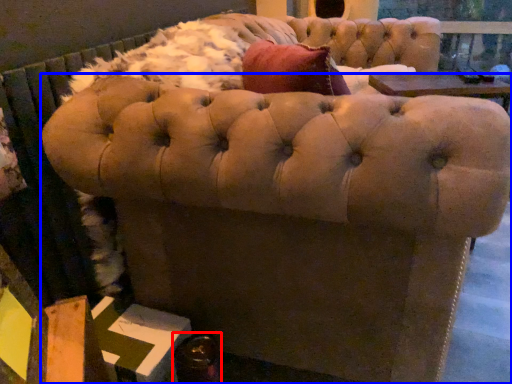
Question: Among these objects, which one is farthest to the camera, bottle (highlighted by a red box) or furniture (highlighted by a blue box)?

Choices:
 (A) bottle
 (B) furniture

Answer: (A)